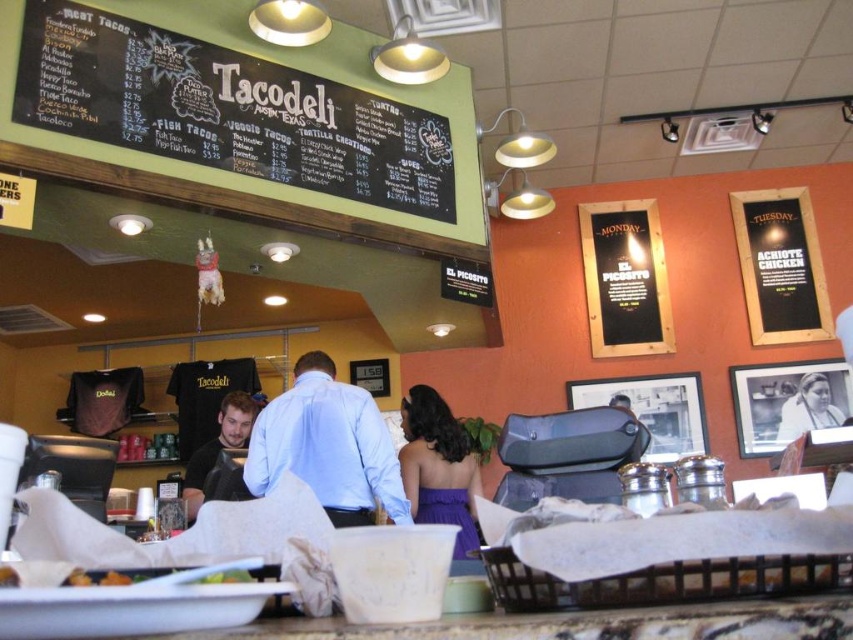
Question: Considering the relative positions of black chalkboard menu at upper center and matte black shirt at center in the image provided, where is black chalkboard menu at upper center located with respect to matte black shirt at center?

Choices:
 (A) below
 (B) above

Answer: (B)

Question: Which of the following is the closest to the observer?

Choices:
 (A) light blue shirt at center
 (B) golden crispy chicken at lower left

Answer: (B)

Question: Which point is farther to the camera?

Choices:
 (A) (215, 458)
 (B) (171, 154)
 (C) (102, 576)
 (D) (328, 416)

Answer: (A)

Question: Where is black chalkboard menu at upper center located in relation to golden crispy chicken at lower left in the image?

Choices:
 (A) left
 (B) right

Answer: (A)

Question: Can you confirm if purple satin dress at center is smaller than matte black shirt at center?

Choices:
 (A) yes
 (B) no

Answer: (B)

Question: Which is nearer to the white glossy photo frame at upper right?

Choices:
 (A) purple satin dress at center
 (B) black chalkboard menu at upper center
 (C) light blue shirt at center
 (D) golden crispy chicken at lower left

Answer: (A)